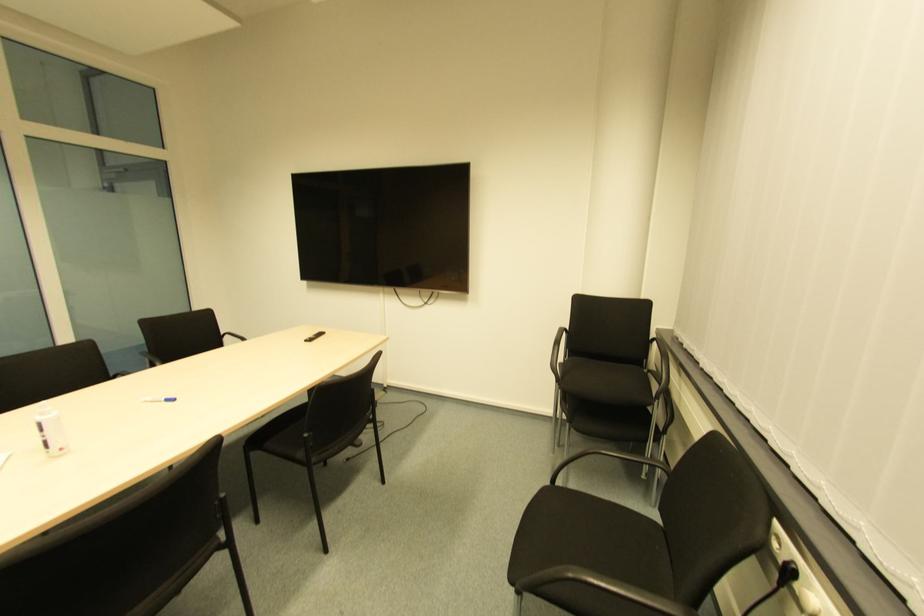
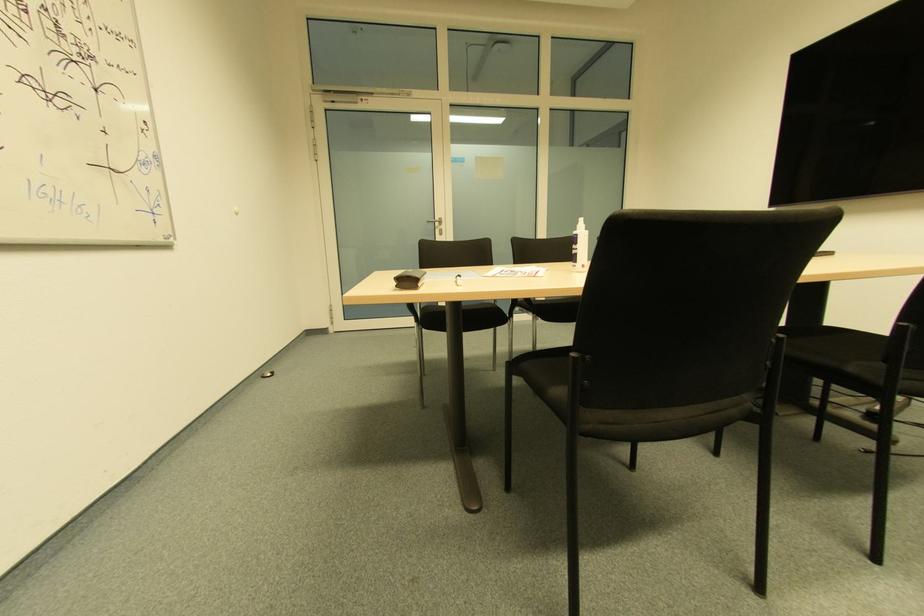
Question: I am providing you with two images of the same scene from different viewpoints. After the viewpoint changes to image2, which objects are now occluded?

Choices:
 (A) dark glasses case
 (B) black chair sitting surface
 (C) black remote control
 (D) green lid jar

Answer: (C)